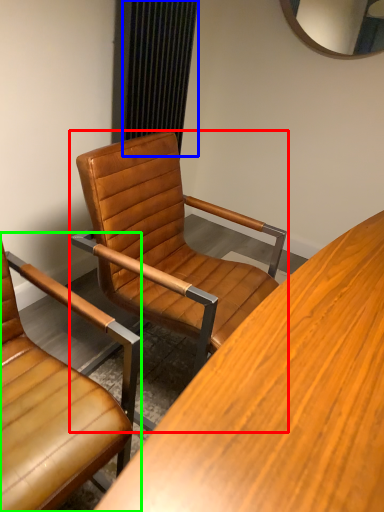
Question: Estimate the real-world distances between objects in this image. Which object is closer to chair (highlighted by a red box), curtain (highlighted by a blue box) or chair (highlighted by a green box)?

Choices:
 (A) curtain
 (B) chair

Answer: (B)